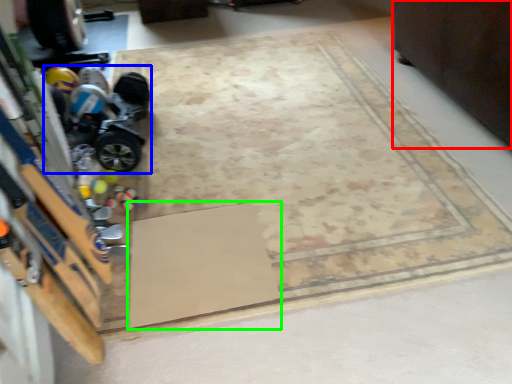
Question: Which object is the farthest from furniture (highlighted by a red box)? Choose among these: toy car (highlighted by a blue box) or doormat (highlighted by a green box).

Choices:
 (A) toy car
 (B) doormat

Answer: (A)